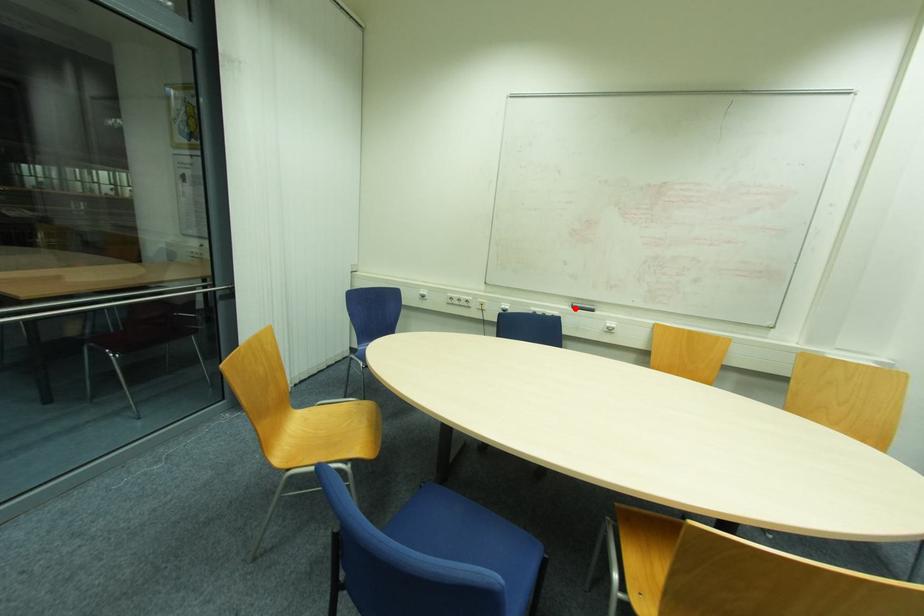
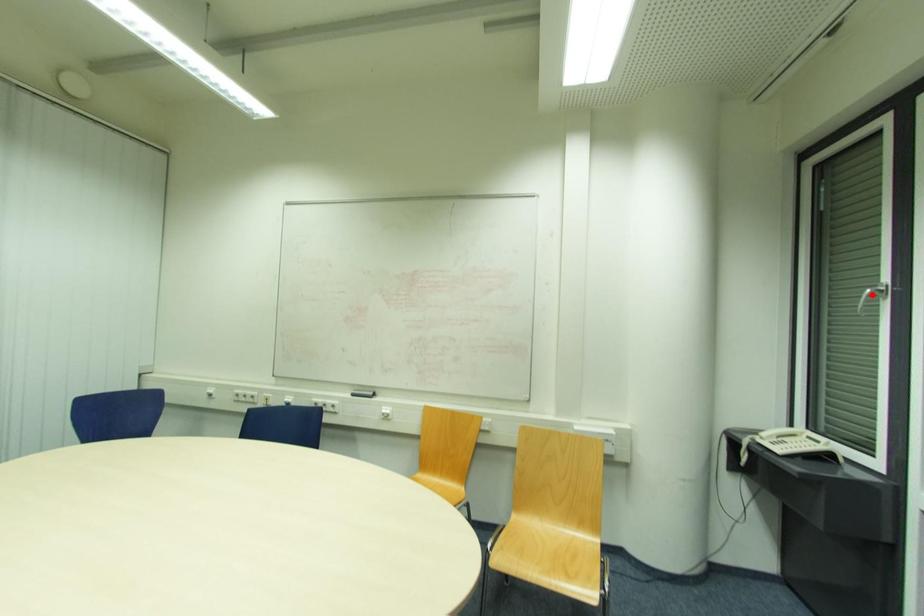
I am providing you with two images of the same scene from different viewpoints. A red point is marked on the first image and another point is marked on the second image. Are the points marked in image1 and image2 representing the same 3D position?

→ No